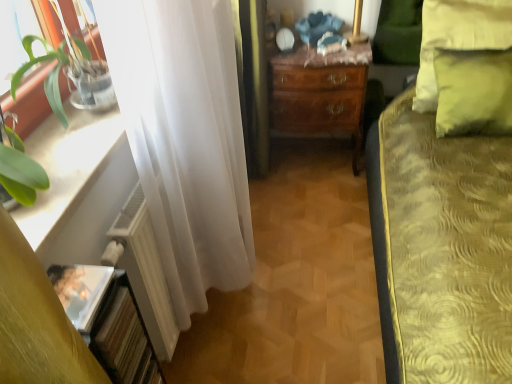
This screenshot has height=384, width=512. I want to click on vacant location behind green leafy plant at left, so click(74, 139).